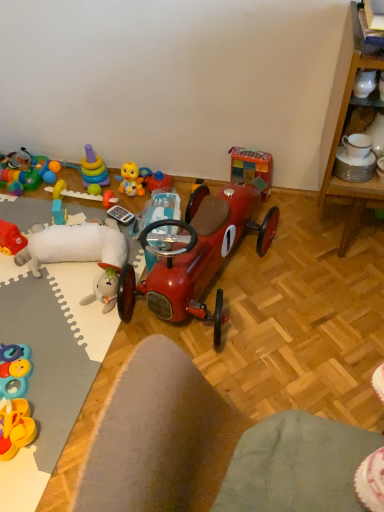
Locate an element on the screen. This screenshot has width=384, height=512. vacant area on the back side of rubber duck at lower left, which is counted as the 7th toy, starting from the right is located at coordinates coord(61,372).